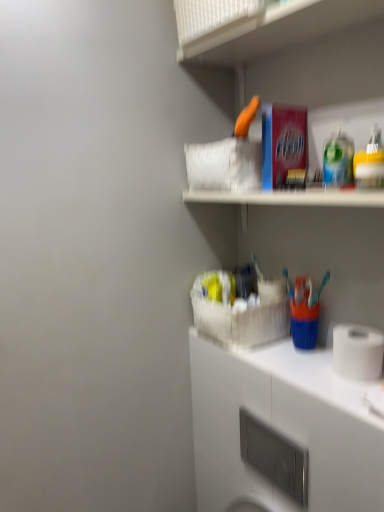
Question: Does satin nickel soap dispenser at lower center have a larger size compared to white matte cabinet at lower right?

Choices:
 (A) no
 (B) yes

Answer: (B)

Question: From a real-world perspective, is satin nickel soap dispenser at lower center on top of white matte cabinet at lower right?

Choices:
 (A) yes
 (B) no

Answer: (B)

Question: Is satin nickel soap dispenser at lower center not within white matte cabinet at lower right?

Choices:
 (A) no
 (B) yes

Answer: (B)

Question: Is satin nickel soap dispenser at lower center further to camera compared to white matte cabinet at lower right?

Choices:
 (A) no
 (B) yes

Answer: (B)

Question: Considering the relative sizes of satin nickel soap dispenser at lower center and white matte cabinet at lower right in the image provided, is satin nickel soap dispenser at lower center thinner than white matte cabinet at lower right?

Choices:
 (A) yes
 (B) no

Answer: (A)

Question: Considering the relative sizes of satin nickel soap dispenser at lower center and white matte cabinet at lower right in the image provided, is satin nickel soap dispenser at lower center smaller than white matte cabinet at lower right?

Choices:
 (A) yes
 (B) no

Answer: (B)

Question: Is white matte toilet paper at lower right oriented away from satin nickel soap dispenser at lower center?

Choices:
 (A) no
 (B) yes

Answer: (A)

Question: Is white matte toilet paper at lower right positioned far away from satin nickel soap dispenser at lower center?

Choices:
 (A) no
 (B) yes

Answer: (A)

Question: Is white matte toilet paper at lower right beside satin nickel soap dispenser at lower center?

Choices:
 (A) yes
 (B) no

Answer: (B)

Question: Does white matte toilet paper at lower right have a greater height compared to satin nickel soap dispenser at lower center?

Choices:
 (A) yes
 (B) no

Answer: (B)

Question: From a real-world perspective, is white matte toilet paper at lower right under satin nickel soap dispenser at lower center?

Choices:
 (A) no
 (B) yes

Answer: (A)

Question: Does white matte toilet paper at lower right turn towards satin nickel soap dispenser at lower center?

Choices:
 (A) no
 (B) yes

Answer: (A)

Question: Is white matte cabinet at lower right surrounding satin nickel soap dispenser at lower center?

Choices:
 (A) yes
 (B) no

Answer: (B)